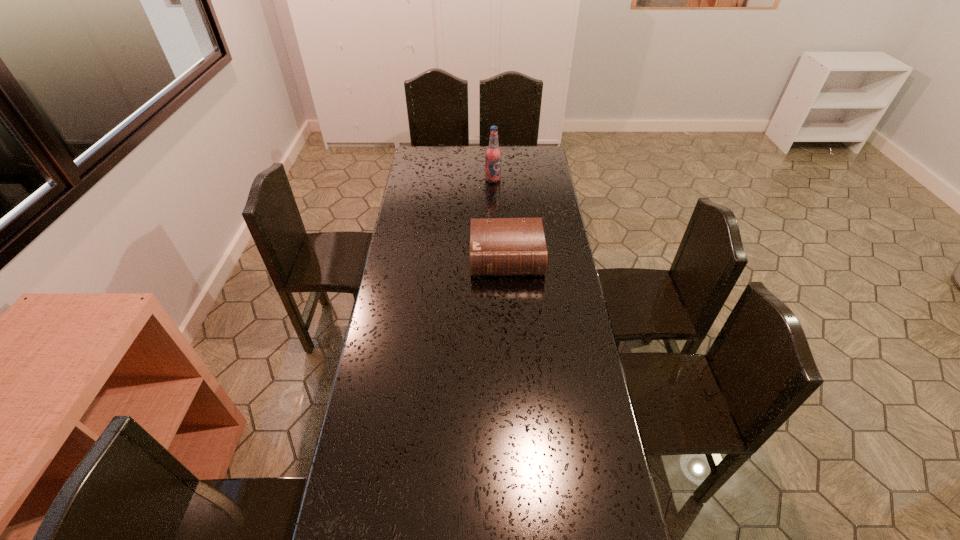
You are a GUI agent. You are given a task and a screenshot of the screen. Output one action in this format:
    pyautogui.click(x=<x>, y=<y>)
    Task: Click on the blank space at the far right corner of the desktop
    This screenshot has height=540, width=960.
    Given the screenshot: What is the action you would take?
    pyautogui.click(x=547, y=165)